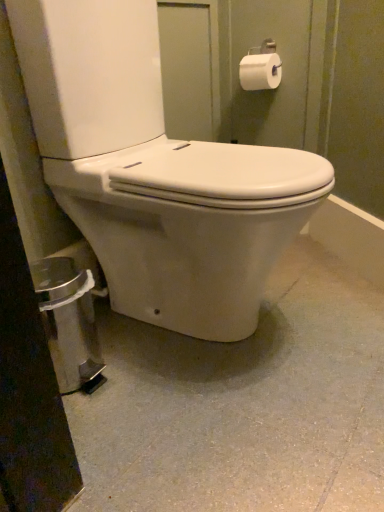
Question: From a real-world perspective, relative to white smooth concrete at center, is white matte toilet paper at upper right vertically above or below?

Choices:
 (A) below
 (B) above

Answer: (B)

Question: Visually, is white matte toilet paper at upper right positioned to the left or to the right of white smooth concrete at center?

Choices:
 (A) left
 (B) right

Answer: (B)

Question: Which object is positioned farthest from the white glossy toilet at center?

Choices:
 (A) white smooth concrete at center
 (B) white matte toilet paper at upper right

Answer: (B)

Question: Which object is positioned closest to the white smooth concrete at center?

Choices:
 (A) white glossy toilet at center
 (B) white matte toilet paper at upper right

Answer: (A)